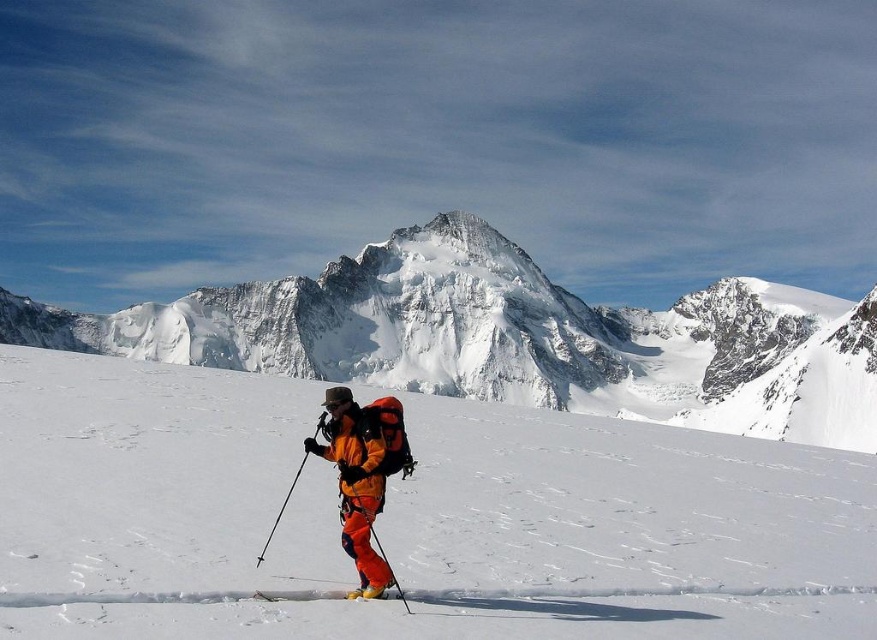
You are planning to take a photo of the snowy granite peak at center and the orange plastic ski pole at center from a distance. Which object will appear wider in the photo?

The snowy granite peak at center will appear wider in the photo because its width surpasses that of the orange plastic ski pole at center.

You are a drone operator trying to capture the best aerial shot of the mountaineer. You have two points marked on your screen, point A at coordinates point (431,369) and point B at coordinates point (344,513). Which point is closer to the mountaineer?

Point A at coordinates point (431,369) is closer to the mountaineer because it is further to the viewer than point B at coordinates point (344,513).